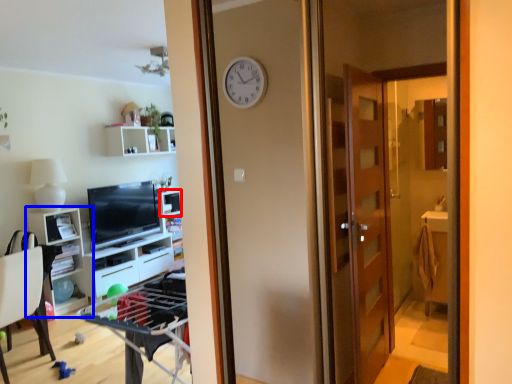
Question: Which object is further to the camera taking this photo, shelf (highlighted by a red box) or cabinetry (highlighted by a blue box)?

Choices:
 (A) shelf
 (B) cabinetry

Answer: (A)